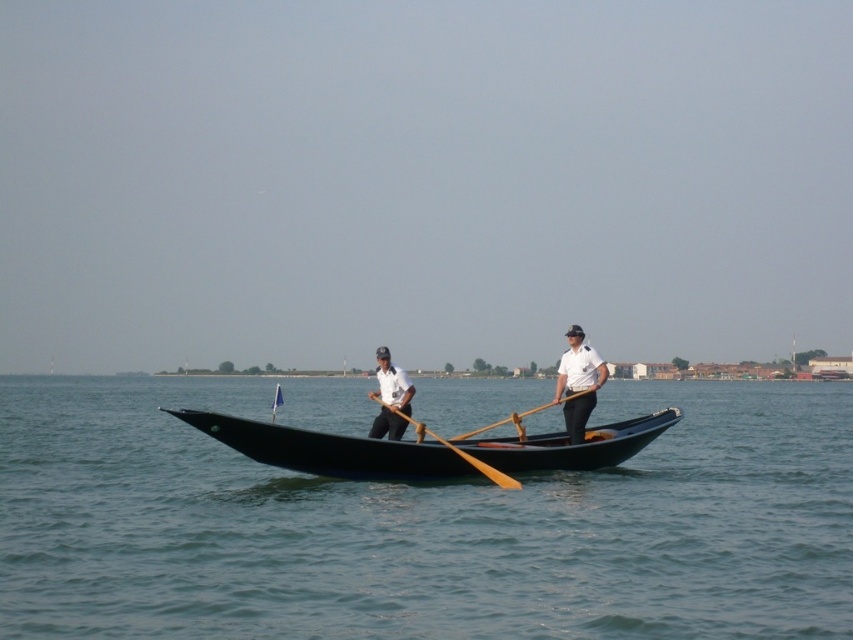
Question: Which point appears closest to the camera in this image?

Choices:
 (A) (144, 406)
 (B) (520, 436)
 (C) (517, 412)
 (D) (566, 420)

Answer: (D)

Question: Which point is farther to the camera?

Choices:
 (A) wooden at center
 (B) wooden paddle at center
 (C) white uniform at center
 (D) white matte shirt at center

Answer: (C)

Question: Does black polished wood canoe at center appear on the right side of wooden paddle at center?

Choices:
 (A) yes
 (B) no

Answer: (B)

Question: Does black polished wood canoe at center appear on the right side of wooden paddle at center?

Choices:
 (A) no
 (B) yes

Answer: (A)

Question: Among these points, which one is farthest from the camera?

Choices:
 (A) (380, 401)
 (B) (589, 362)
 (C) (401, 417)
 (D) (595, 444)

Answer: (B)

Question: Does smooth blue water at center lie behind black polished wood canoe at center?

Choices:
 (A) no
 (B) yes

Answer: (A)